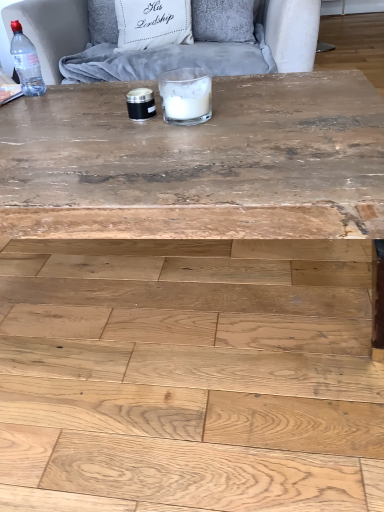
Find the location of a particular element. The height and width of the screenshot is (512, 384). transparent plastic bottle at top left is located at coordinates (26, 62).

At what (x,y) coordinates should I click in order to perform the action: click on wooden coffee table at center. Please return your answer as a coordinate pair (x, y). The image size is (384, 512). Looking at the image, I should click on (198, 163).

What is the approximate height of natural wood plywood at lower center?

natural wood plywood at lower center is 2.53 inches in height.

At what (x,y) coordinates should I click in order to perform the action: click on white glass candle at center. Please return your answer as a coordinate pair (x, y). This screenshot has width=384, height=512. Looking at the image, I should click on (186, 96).

The height and width of the screenshot is (512, 384). What do you see at coordinates (152, 23) in the screenshot? I see `white fabric pillow at upper center` at bounding box center [152, 23].

Where is `transparent plastic bottle at top left`? Image resolution: width=384 pixels, height=512 pixels. transparent plastic bottle at top left is located at coordinates (26, 62).

Could natural wood plywood at lower center be considered to be inside white fabric pillow at upper center?

No, natural wood plywood at lower center is located outside of white fabric pillow at upper center.

Is white fabric pillow at upper center aimed at natural wood plywood at lower center?

Yes, white fabric pillow at upper center is facing natural wood plywood at lower center.

Is white fabric pillow at upper center to the right of natural wood plywood at lower center from the viewer's perspective?

In fact, white fabric pillow at upper center is to the left of natural wood plywood at lower center.

Does point (144, 37) lie in front of point (195, 283)?

No, it is not.

Does wooden coffee table at center have a larger size compared to natural wood plywood at lower center?

Correct, wooden coffee table at center is larger in size than natural wood plywood at lower center.

Considering the sizes of objects wooden coffee table at center and natural wood plywood at lower center in the image provided, who is taller, wooden coffee table at center or natural wood plywood at lower center?

With more height is wooden coffee table at center.

Is wooden coffee table at center far away from natural wood plywood at lower center?

No, wooden coffee table at center is in close proximity to natural wood plywood at lower center.

Can you confirm if wooden coffee table at center is thinner than natural wood plywood at lower center?

Incorrect, the width of wooden coffee table at center is not less than that of natural wood plywood at lower center.

Which of these two, velvet grey armchair at upper center or white glass candle at center, is smaller?

With smaller size is white glass candle at center.

Is white glass candle at center at the back of velvet grey armchair at upper center?

No, velvet grey armchair at upper center is not facing away from white glass candle at center.

Who is taller, velvet grey armchair at upper center or white glass candle at center?

With more height is velvet grey armchair at upper center.

Is velvet grey armchair at upper center completely or partially outside of white glass candle at center?

Yes, velvet grey armchair at upper center is outside of white glass candle at center.

Can you confirm if natural wood plywood at lower center is positioned to the left of white glass candle at center?

Yes, natural wood plywood at lower center is to the left of white glass candle at center.

Based on the photo, considering the relative positions of natural wood plywood at lower center and white glass candle at center in the image provided, is natural wood plywood at lower center in front of white glass candle at center?

Yes, it is.

Considering the sizes of objects natural wood plywood at lower center and white glass candle at center in the image provided, who is bigger, natural wood plywood at lower center or white glass candle at center?

natural wood plywood at lower center.

Is white fabric pillow at upper center directly adjacent to velvet grey armchair at upper center?

No, white fabric pillow at upper center is not beside velvet grey armchair at upper center.

Considering the relative sizes of white fabric pillow at upper center and velvet grey armchair at upper center in the image provided, is white fabric pillow at upper center shorter than velvet grey armchair at upper center?

Correct, white fabric pillow at upper center is not as tall as velvet grey armchair at upper center.

Considering the relative sizes of white fabric pillow at upper center and velvet grey armchair at upper center in the image provided, is white fabric pillow at upper center bigger than velvet grey armchair at upper center?

Incorrect, white fabric pillow at upper center is not larger than velvet grey armchair at upper center.

From the image's perspective, which object appears higher, white fabric pillow at upper center or velvet grey armchair at upper center?

white fabric pillow at upper center is shown above in the image.

Can wooden coffee table at center be found inside white glass candle at center?

No, wooden coffee table at center is located outside of white glass candle at center.

Does white glass candle at center come in front of wooden coffee table at center?

No, white glass candle at center is further to the viewer.

Can you confirm if white glass candle at center is thinner than wooden coffee table at center?

Indeed, white glass candle at center has a lesser width compared to wooden coffee table at center.

From a real-world perspective, is white glass candle at center located beneath wooden coffee table at center?

Incorrect, from a real-world perspective, white glass candle at center is higher than wooden coffee table at center.

Between transparent plastic bottle at top left and white fabric pillow at upper center, which one has smaller width?

Thinner between the two is transparent plastic bottle at top left.

Locate an element on the screen. bottle lying below the white fabric pillow at upper center (from the image's perspective) is located at coordinates (26, 62).

Is point (29, 49) positioned after point (126, 39)?

No.

From the image's perspective, would you say transparent plastic bottle at top left is positioned over white fabric pillow at upper center?

Incorrect, from the image's perspective, transparent plastic bottle at top left is lower than white fabric pillow at upper center.

The width and height of the screenshot is (384, 512). Identify the location of pillow to the left of natural wood plywood at lower center. (152, 23).

At what (x,y) coordinates should I click in order to perform the action: click on plywood on the right of wooden coffee table at center. Please return your answer as a coordinate pair (x, y). Looking at the image, I should click on (189, 376).

When comparing their distances from transparent plastic bottle at top left, does white glass candle at center or natural wood plywood at lower center seem further?

natural wood plywood at lower center lies further to transparent plastic bottle at top left than the other object.

Which object lies further to the anchor point white fabric pillow at upper center, white glass candle at center or wooden coffee table at center?

Based on the image, wooden coffee table at center appears to be further to white fabric pillow at upper center.

Based on their spatial positions, is white glass candle at center or wooden coffee table at center further from transparent plastic bottle at top left?

white glass candle at center lies further to transparent plastic bottle at top left than the other object.

Which object lies nearer to the anchor point velvet grey armchair at upper center, transparent plastic bottle at top left or white fabric pillow at upper center?

transparent plastic bottle at top left lies closer to velvet grey armchair at upper center than the other object.

When comparing their distances from wooden coffee table at center, does white glass candle at center or white fabric pillow at upper center seem further?

white fabric pillow at upper center lies further to wooden coffee table at center than the other object.

Based on their spatial positions, is transparent plastic bottle at top left or wooden coffee table at center closer to white glass candle at center?

Among the two, wooden coffee table at center is located nearer to white glass candle at center.

Looking at the image, which one is located further to white glass candle at center, white fabric pillow at upper center or natural wood plywood at lower center?

Among the two, white fabric pillow at upper center is located further to white glass candle at center.

Estimate the real-world distances between objects in this image. Which object is further from velvet grey armchair at upper center, white glass candle at center or white fabric pillow at upper center?

white glass candle at center is further to velvet grey armchair at upper center.

This screenshot has height=512, width=384. Identify the location of armchair between white glass candle at center and white fabric pillow at upper center in the front-back direction. (51, 30).

This screenshot has width=384, height=512. I want to click on candle holder between white fabric pillow at upper center and natural wood plywood at lower center vertically, so click(186, 96).

Find the location of a particular element. candle holder between wooden coffee table at center and white fabric pillow at upper center from front to back is located at coordinates (186, 96).

Find the location of `bottle between velvet grey armchair at upper center and natural wood plywood at lower center in the up-down direction`. bottle between velvet grey armchair at upper center and natural wood plywood at lower center in the up-down direction is located at coordinates tap(26, 62).